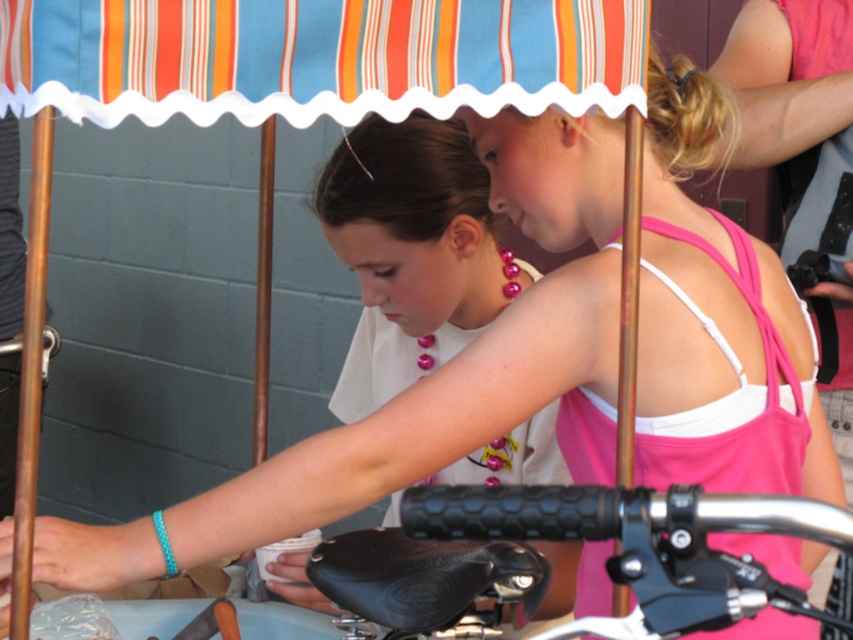
Question: Among these objects, which one is nearest to the camera?

Choices:
 (A) black rubber handlebar at center
 (B) pink pearl necklace at upper center

Answer: (A)

Question: In this image, where is pink pearl necklace at upper center located relative to black rubber handlebar at center?

Choices:
 (A) below
 (B) above

Answer: (B)

Question: Among these points, which one is nearest to the camera?

Choices:
 (A) (811, 508)
 (B) (360, 321)

Answer: (A)

Question: Observing the image, what is the correct spatial positioning of pink pearl necklace at upper center in reference to black rubber handlebar at center?

Choices:
 (A) below
 (B) above

Answer: (B)

Question: Which point is closer to the camera taking this photo?

Choices:
 (A) (432, 502)
 (B) (405, 128)

Answer: (A)

Question: Is pink pearl necklace at upper center wider than black rubber handlebar at center?

Choices:
 (A) yes
 (B) no

Answer: (A)